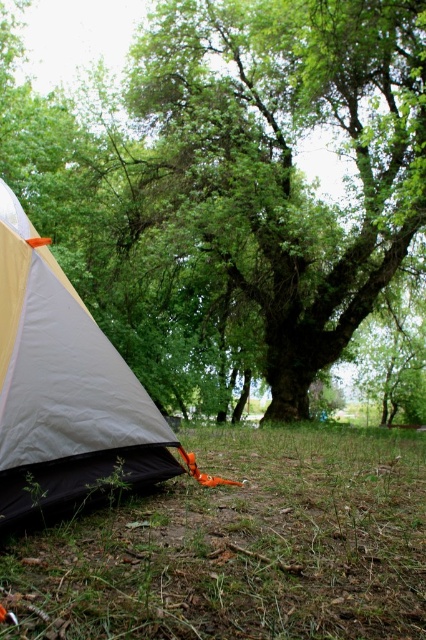
Question: Is green leafy tree at center to the right of green grass at lower center from the viewer's perspective?

Choices:
 (A) no
 (B) yes

Answer: (B)

Question: Which point is closer to the camera?

Choices:
 (A) green grass at lower center
 (B) matte white tent at lower left

Answer: (A)

Question: From the image, what is the correct spatial relationship of green leafy tree at center in relation to matte white tent at lower left?

Choices:
 (A) right
 (B) left

Answer: (A)

Question: Which point is farther to the camera?

Choices:
 (A) (43, 390)
 (B) (132, 196)

Answer: (B)

Question: Is green leafy tree at center bigger than green grass at lower center?

Choices:
 (A) yes
 (B) no

Answer: (B)

Question: Among these objects, which one is nearest to the camera?

Choices:
 (A) green leafy tree at center
 (B) green grass at lower center
 (C) matte white tent at lower left

Answer: (B)